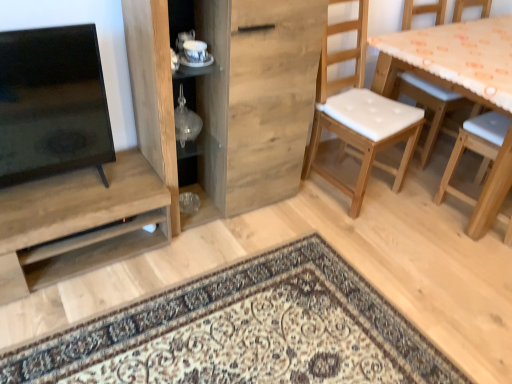
Question: Looking at their shapes, would you say transparent glass vase at center, which is the 2th shelf from left to right, is wider or thinner than matte wood shelf at left, placed as the 1th shelf when sorted from bottom to top?

Choices:
 (A) wide
 (B) thin

Answer: (B)

Question: Does point (181, 114) appear closer or farther from the camera than point (139, 226)?

Choices:
 (A) farther
 (B) closer

Answer: (A)

Question: Estimate the real-world distances between objects in this image. Which object is farther from the white padded wood chair at right?

Choices:
 (A) matte wood shelf at left, placed as the 1th shelf when sorted from bottom to top
 (B) wooden cabinet at center
 (C) transparent glass vase at center, which is the 2th shelf from bottom to top
 (D) wooden table with orange patterned cloth at right

Answer: (A)

Question: Based on their relative distances, which object is nearer to the transparent glass vase at center, which is the 2th shelf from bottom to top?

Choices:
 (A) wooden cabinet at center
 (B) matte wood shelf at left, arranged as the 2th shelf when viewed from the top
 (C) white padded wood chair at right
 (D) wooden table with orange patterned cloth at right

Answer: (A)